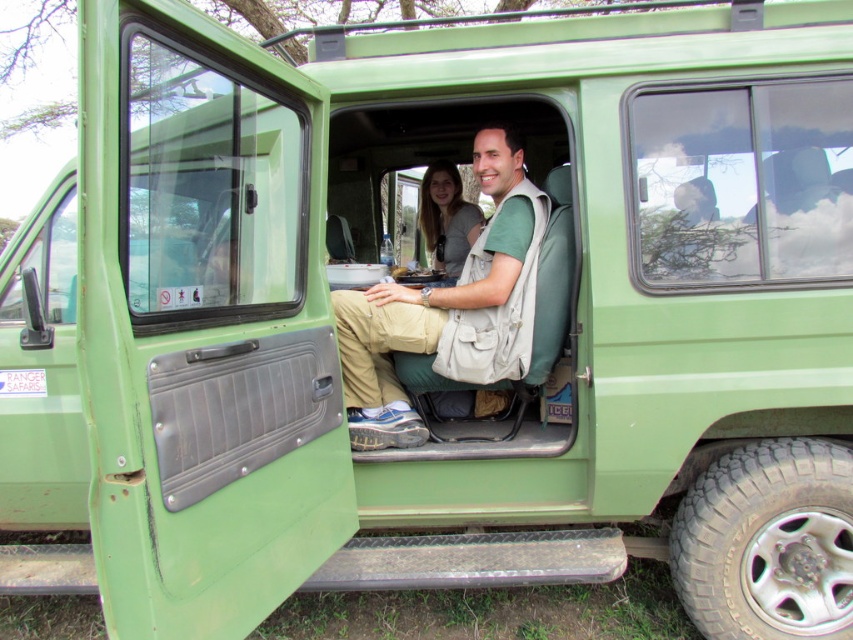
You are a photographer standing outside the safari vehicle and want to take a photo of the matte khaki pants at center and the matte gray sweater at center. Which one will appear larger in the photo?

The matte khaki pants at center will appear larger in the photo because it is taller than the matte gray sweater at center.

You are a tour guide standing outside the safari vehicle and want to hand a map to the person wearing the matte khaki pants at center and the matte gray sweater at center. Which one should you approach first based on their positions?

The matte khaki pants at center is closer to the viewer than the matte gray sweater at center, so you should approach the person wearing the matte khaki pants at center first.